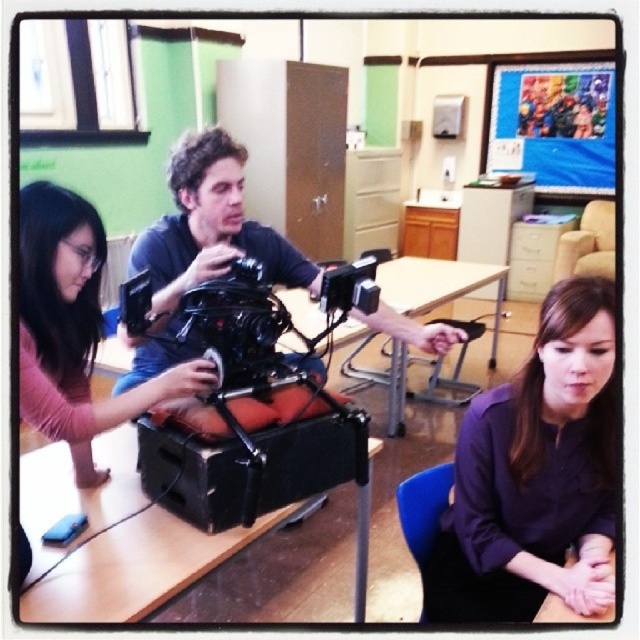
You are standing in the classroom and want to place a small tripod between the matte pink shirt at left and the wooden table at center. Which object should you move closer to ensure the tripod fits?

The matte pink shirt at left is closer to the viewer than the wooden table at center, so you should move the wooden table at center closer to the matte pink shirt at left to create enough space for the tripod.

You are a technician who needs to move a 10 feet long cable from the wooden table at center to the camera. Is the cable long enough to reach?

The distance between the wooden table at center and the camera is 9.72 feet, so the 10 feet cable is long enough to reach.

You are setting up a photography studio in the classroom. You have two wooden tables available, the wooden table at center and the wooden table at lower center. Which table should you choose if you need a taller surface for placing your camera equipment?

You should choose the wooden table at center because it is taller than the wooden table at lower center, making it suitable for placing camera equipment.